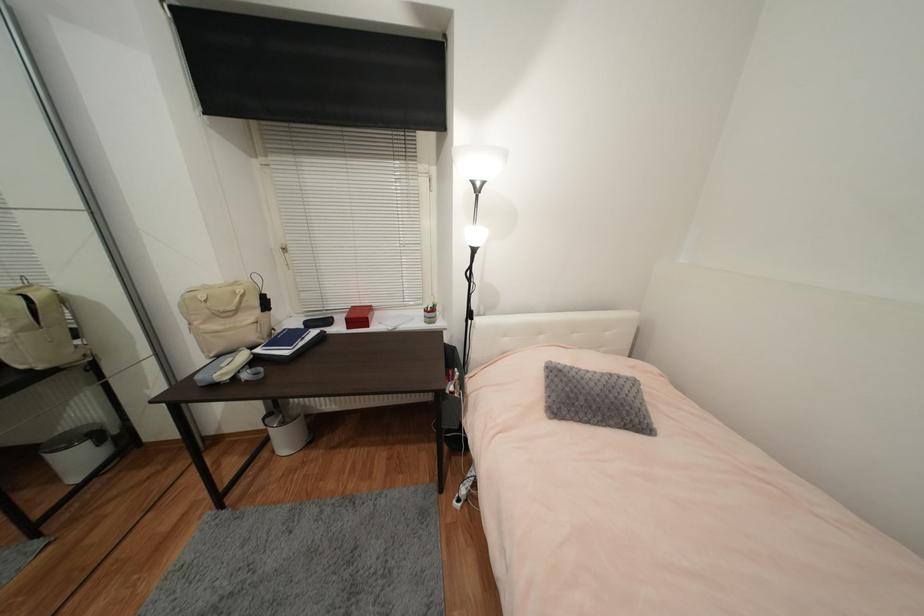
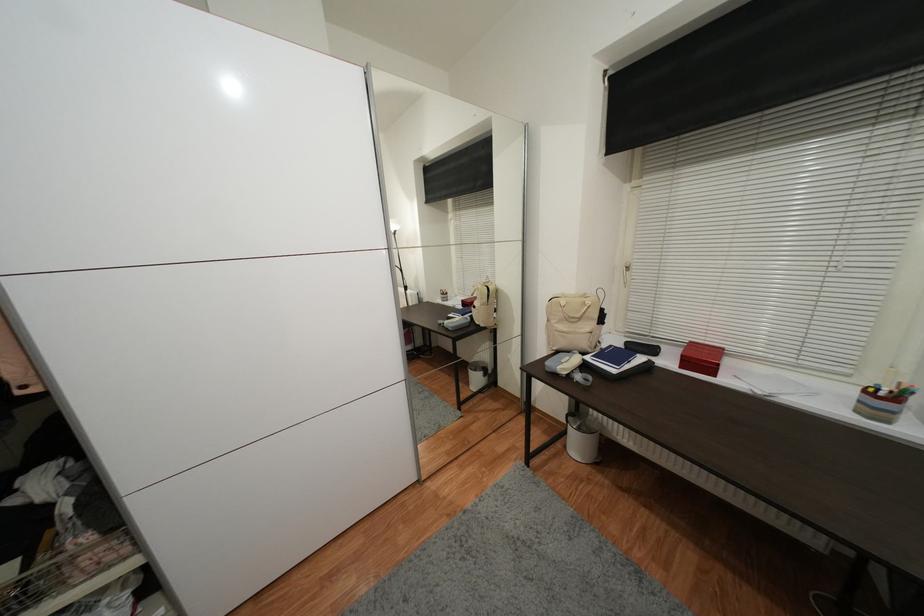
Find the pixel in the second image that matches [262,352] in the first image.

(592, 360)